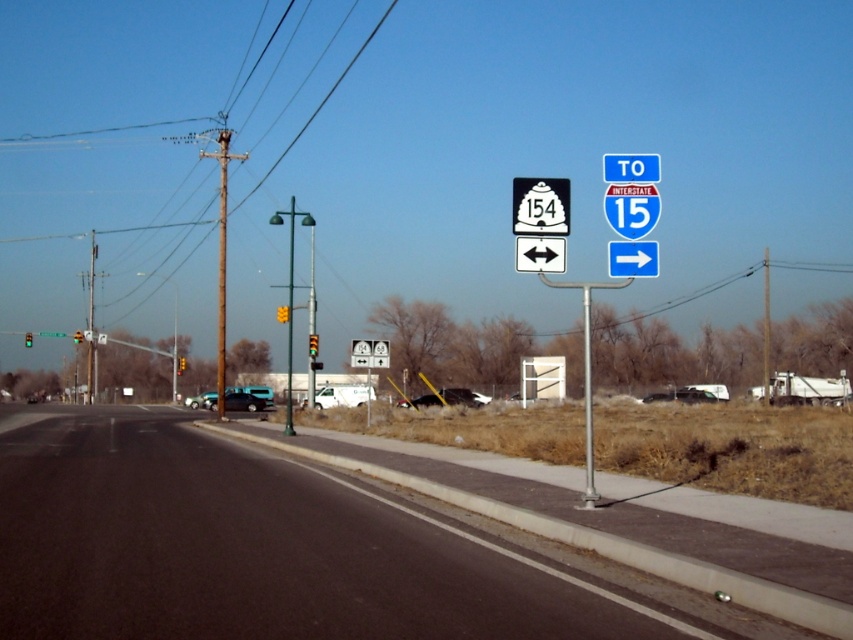
You are a driver approaching the intersection and see the white matte van at center and the black matte car at center. Which vehicle is taller?

The white matte van at center is taller than the black matte car at center.

You are standing on the sidewalk next to the two highway signs. You notice two points marked on the signs at coordinates point (370,392) and point (471,392). Which point is closer to you?

Point (370,392) is closer to you because it is further to the viewer than point (471,392).